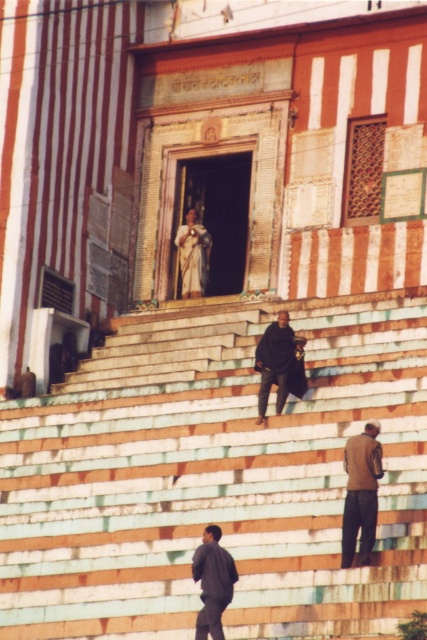
Question: Which point is closer to the camera taking this photo?

Choices:
 (A) (391, 476)
 (B) (221, 600)

Answer: (B)

Question: Which point is closer to the camera?

Choices:
 (A) (202, 636)
 (B) (201, 243)
 (C) (283, 317)

Answer: (A)

Question: Estimate the real-world distances between objects in this image. Which object is closer to the dark gray fabric pants at lower center?

Choices:
 (A) brown leather jacket at lower right
 (B) white fabric statue at center
 (C) dark matte coat at center

Answer: (A)

Question: Does multicolored stone steps at center have a greater width compared to white fabric statue at center?

Choices:
 (A) no
 (B) yes

Answer: (B)

Question: Is multicolored stone steps at center below dark matte coat at center?

Choices:
 (A) yes
 (B) no

Answer: (A)

Question: Does multicolored stone steps at center have a larger size compared to dark gray fabric pants at lower center?

Choices:
 (A) yes
 (B) no

Answer: (A)